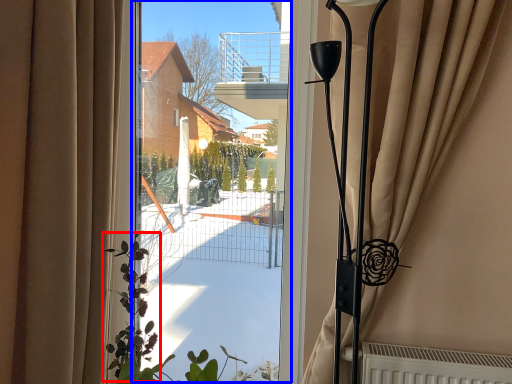
Question: Which point is further to the camera, plant (highlighted by a red box) or window screen (highlighted by a blue box)?

Choices:
 (A) plant
 (B) window screen

Answer: (B)